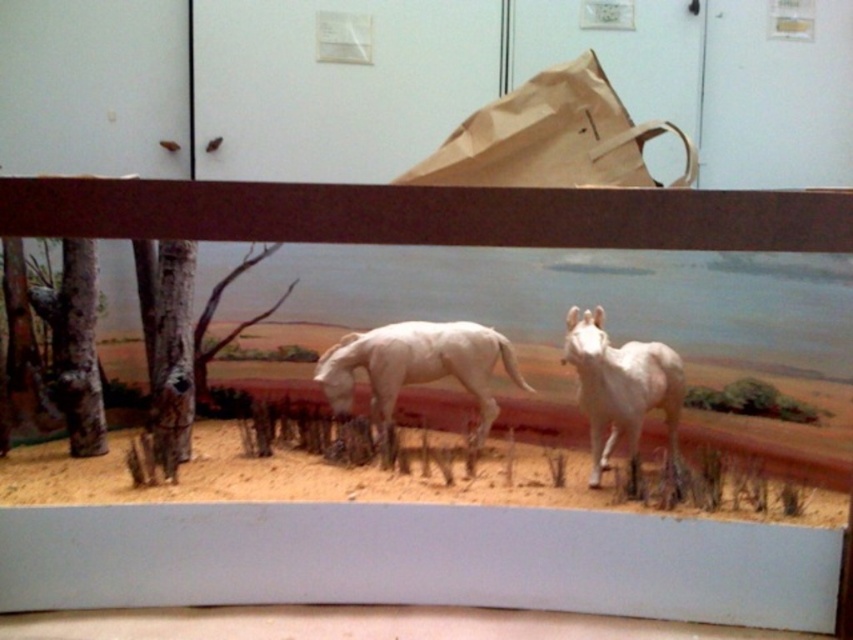
Question: Which point is farther from the camera taking this photo?

Choices:
 (A) (461, 333)
 (B) (595, 328)
 (C) (456, 147)

Answer: (A)

Question: Estimate the real-world distances between objects in this image. Which object is closer to the white matte horse at center?

Choices:
 (A) brown paper bag at upper center
 (B) white glossy horse at center

Answer: (B)

Question: Is white matte horse at center to the left of white glossy horse at center from the viewer's perspective?

Choices:
 (A) no
 (B) yes

Answer: (B)

Question: Where is brown paper bag at upper center located in relation to white matte horse at center in the image?

Choices:
 (A) right
 (B) left

Answer: (A)

Question: Can you confirm if brown paper bag at upper center is positioned above white glossy horse at center?

Choices:
 (A) no
 (B) yes

Answer: (B)

Question: Which is nearer to the white glossy horse at center?

Choices:
 (A) brown paper bag at upper center
 (B) white matte horse at center

Answer: (B)